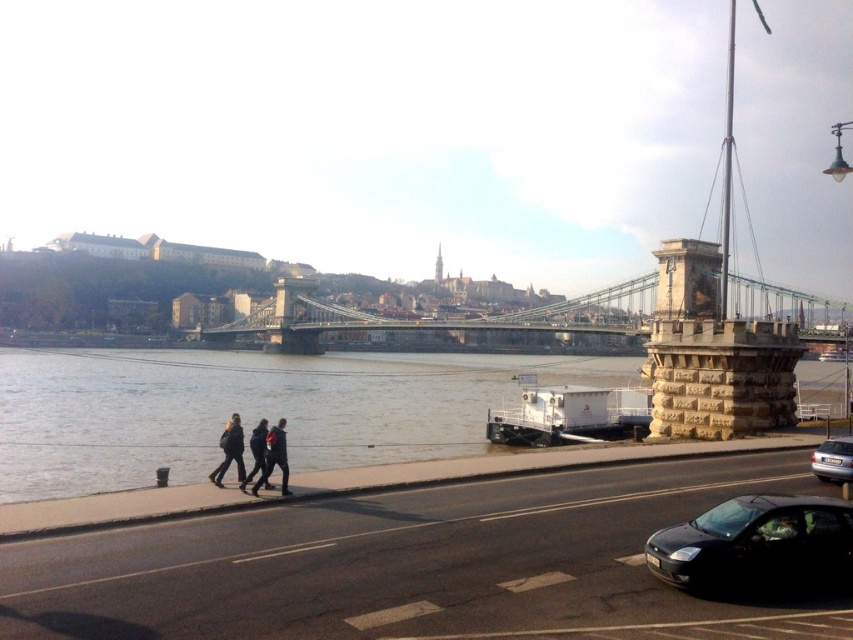
Describe the element at coordinates (502, 314) in the screenshot. I see `green metallic suspension bridge at center` at that location.

Can you confirm if green metallic suspension bridge at center is taller than dark blue jeans at lower center?

Indeed, green metallic suspension bridge at center has a greater height compared to dark blue jeans at lower center.

The width and height of the screenshot is (853, 640). Find the location of `green metallic suspension bridge at center`. green metallic suspension bridge at center is located at coordinates (502, 314).

Find the location of a particular element. This screenshot has width=853, height=640. green metallic suspension bridge at center is located at coordinates (502, 314).

Can you confirm if white matte ferry at lower right is smaller than dark gray fabric coat at lower left?

No.

Does white matte ferry at lower right appear on the right side of dark gray fabric coat at lower left?

Yes, white matte ferry at lower right is to the right of dark gray fabric coat at lower left.

Between point (625, 433) and point (285, 438), which one is positioned in front?

Positioned in front is point (285, 438).

Locate an element on the screen. This screenshot has height=640, width=853. white matte ferry at lower right is located at coordinates (570, 416).

Is brown water at lower center to the left of dark gray fabric coat at lower left from the viewer's perspective?

Incorrect, brown water at lower center is not on the left side of dark gray fabric coat at lower left.

Does brown water at lower center appear under dark gray fabric coat at lower left?

Correct, brown water at lower center is located below dark gray fabric coat at lower left.

You are a GUI agent. You are given a task and a screenshot of the screen. Output one action in this format:
    pyautogui.click(x=<x>, y=<y>)
    Task: Click on the brown water at lower center
    This screenshot has width=853, height=640.
    Given the screenshot: What is the action you would take?
    pyautogui.click(x=248, y=410)